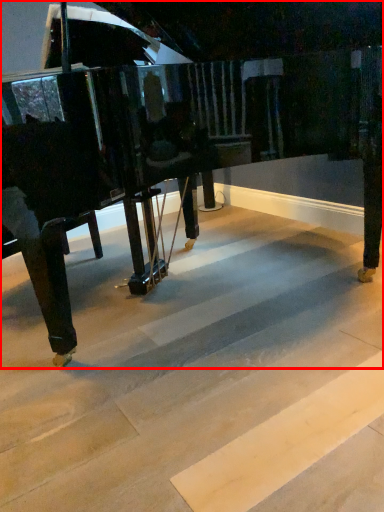
Question: Where is piano (annotated by the red box) located in relation to stair in the image?

Choices:
 (A) left
 (B) right

Answer: (B)